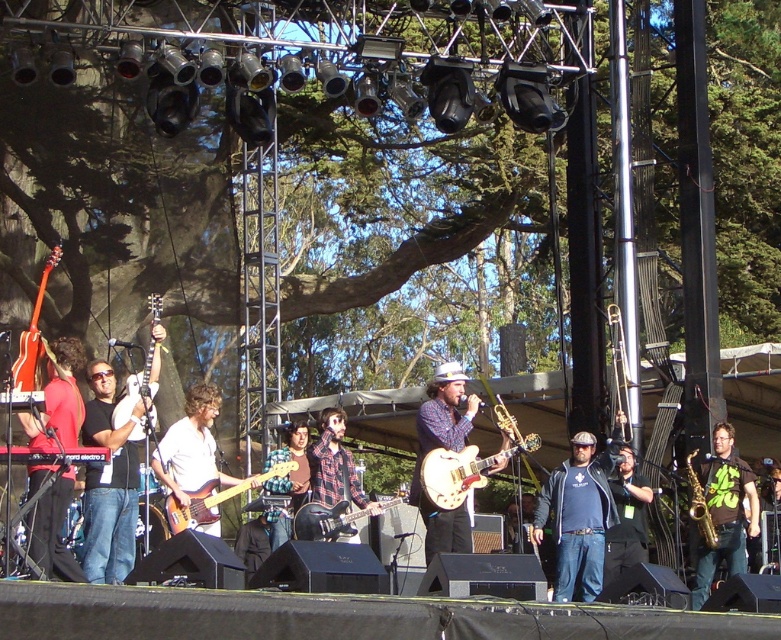
You are a photographer standing at the front of the stage. You want to take a closeup photo of the plaid fabric guitar at center. Considering the distance between you and the guitar, is it feasible to capture a clear, detailed image without moving closer?

The plaid fabric guitar at center is 180.99 feet away from the viewer. At this distance, capturing a clear, detailed closeup photo without moving closer would be challenging due to the significant distance involved.

You are a photographer positioned at the back of the stage. You want to capture a clear photo of the blue denim jeans at center and the plaid fabric guitar at center. Which object should you focus on first if you want to ensure both are in focus without adjusting your camera settings?

The blue denim jeans at center has a lesser height compared to the plaid fabric guitar at center, so you should focus on the plaid fabric guitar at center first since it is taller and likely farther away, ensuring depth of field covers both.

You are a photographer standing at the front of the stage. You want to take a photo of both the blue denim jeans at center and the plaid fabric guitar at center. Which object will appear larger in your photo?

The blue denim jeans at center will appear larger in the photo because it is closer to the photographer than the plaid fabric guitar at center.